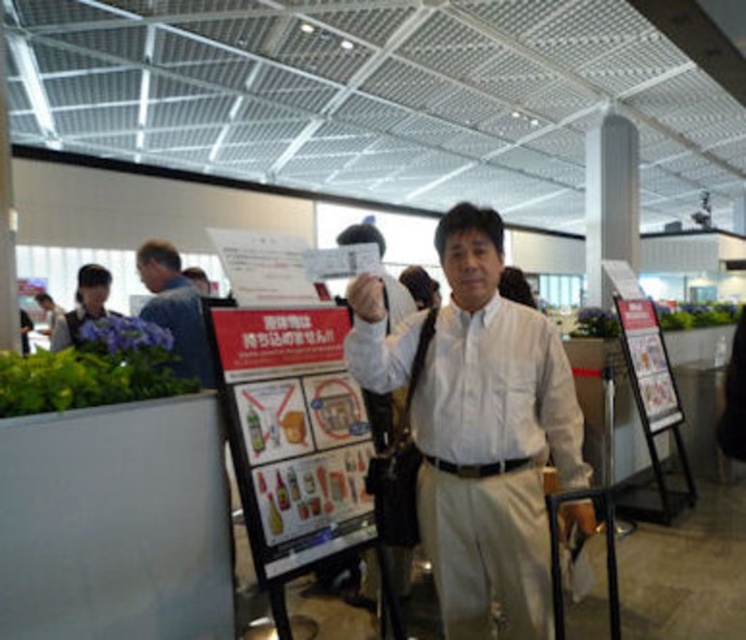
Question: Is white textured shirt at center behind white smooth shirt at center?

Choices:
 (A) yes
 (B) no

Answer: (B)

Question: Is white smooth shirt at center to the right of matte black shirt at left from the viewer's perspective?

Choices:
 (A) no
 (B) yes

Answer: (B)

Question: Where is white smooth shirt at center located in relation to matte black shirt at left in the image?

Choices:
 (A) below
 (B) above

Answer: (A)

Question: Which object is positioned farthest from the white smooth shirt at center?

Choices:
 (A) blue denim shirt at left
 (B) matte black shirt at left
 (C) white textured shirt at center

Answer: (B)

Question: Which point is closer to the camera taking this photo?

Choices:
 (A) (448, 406)
 (B) (68, 320)

Answer: (A)

Question: Among these objects, which one is nearest to the camera?

Choices:
 (A) white textured shirt at center
 (B) blue denim shirt at left
 (C) matte black shirt at left

Answer: (A)